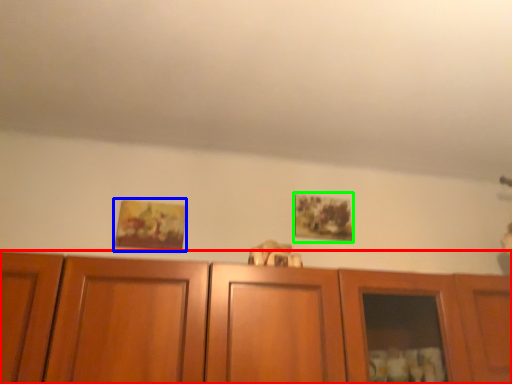
Question: Based on their relative distances, which object is farther from cabinetry (highlighted by a red box)? Choose from picture frame (highlighted by a blue box) and picture frame (highlighted by a green box).

Choices:
 (A) picture frame
 (B) picture frame

Answer: (A)